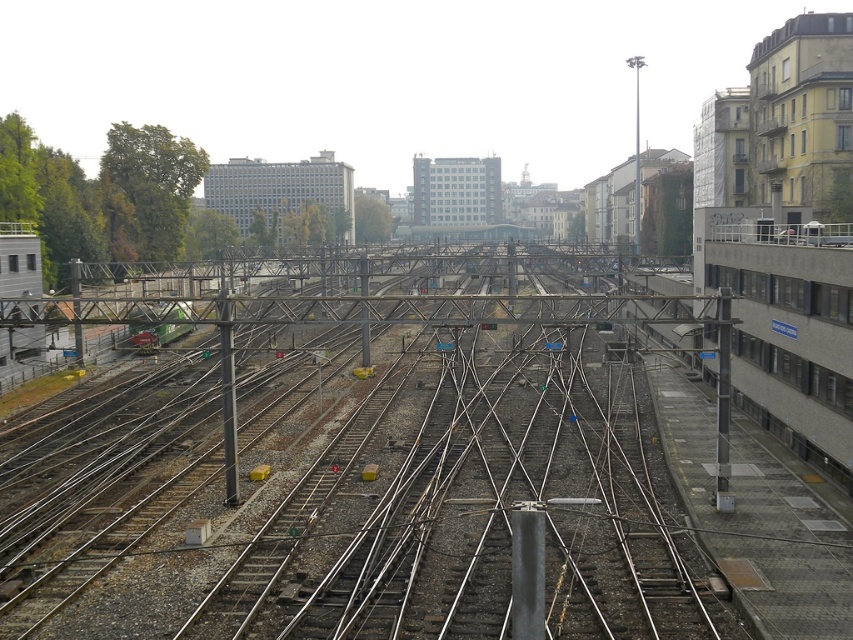
What object is located at the coordinate point (357,481) in the railway yard scene?

The point at coordinate (357,481) corresponds to metal at center.

You are a train conductor who needs to inspect the metal at center and the green matte train at center. Which object is located to the right of the other?

The metal at center is positioned on the right side of green matte train at center.

You are standing at the center of the railway yard. There is a metal structure at center. Where is the metal at center located in terms of coordinates?

The metal at center is located at coordinates point (357, 481).